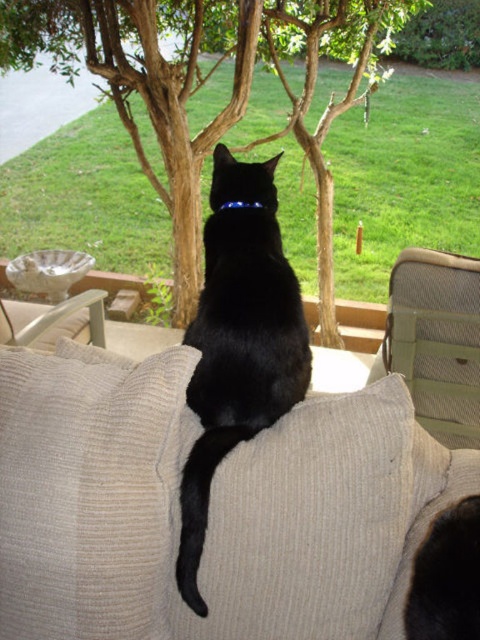
You are a photographer trying to capture the black matte fur cat at center and the beige mesh armchair at right in a single frame. Based on their sizes, which object will appear bigger in the photo?

The black matte fur cat at center will appear bigger in the photo since it has a larger size compared to the beige mesh armchair at right.

You are a guest at a garden party and need to choose between the beige mesh armchair at right and the beige corduroy armchair at left. Which chair has a wider seating area?

The beige corduroy armchair at left has a wider seating area than the beige mesh armchair at right.

You are a photographer trying to capture the black matte fur cat at center and the beige mesh armchair at right in a single shot. Based on their positions, which object will appear larger in the photo?

The black matte fur cat at center will appear larger in the photo because it is closer to the viewer than the beige mesh armchair at right.